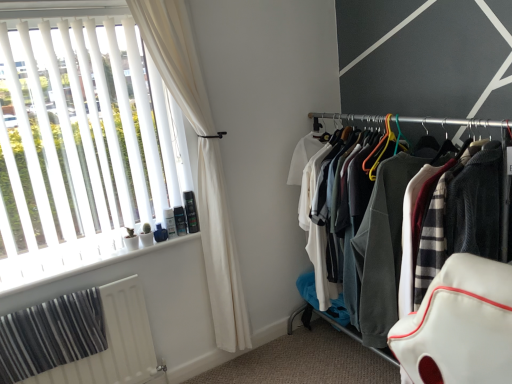
In order to click on free point above white blinds at left (from a real-world perspective) in this screenshot , I will do `click(69, 8)`.